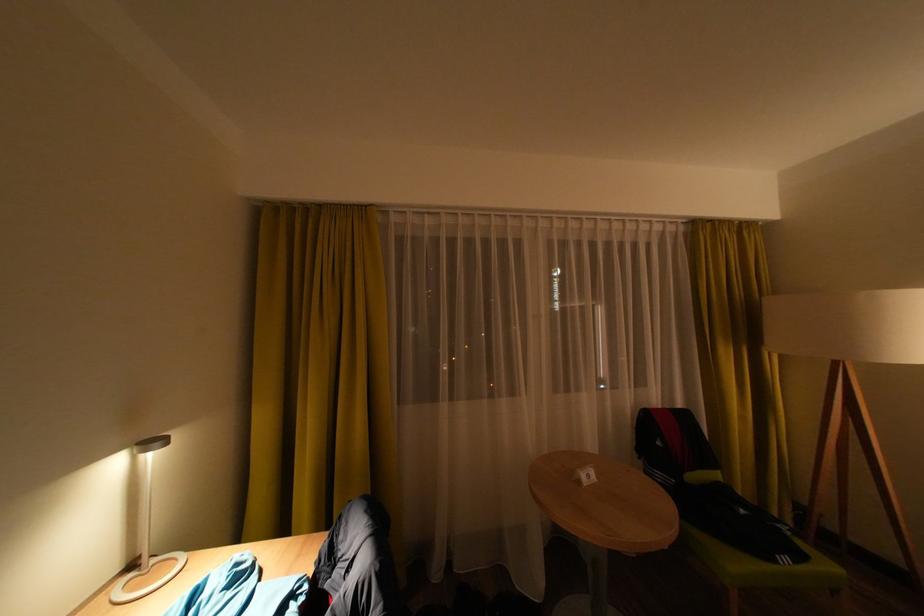
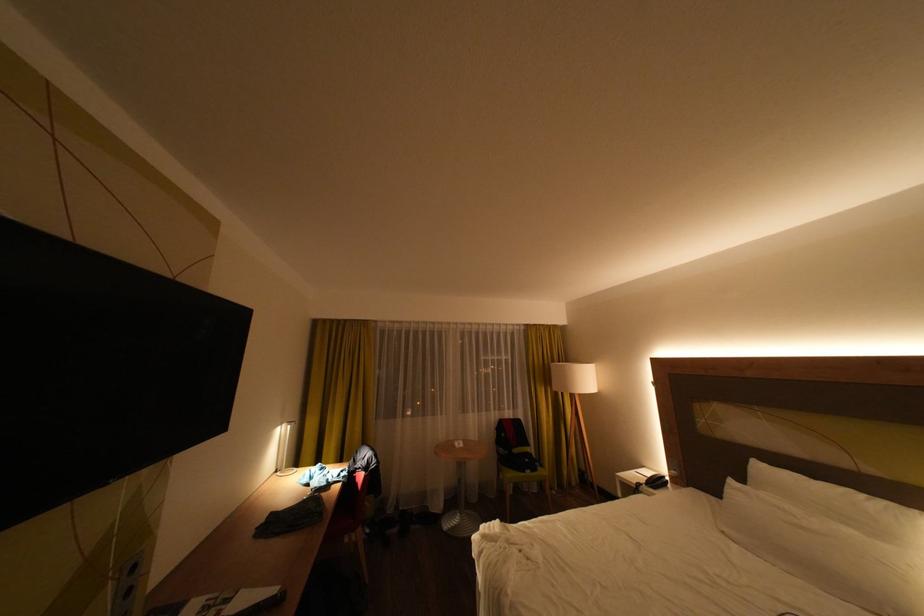
Where in the second image is the point corresponding to [806,509] from the first image?

(590, 472)